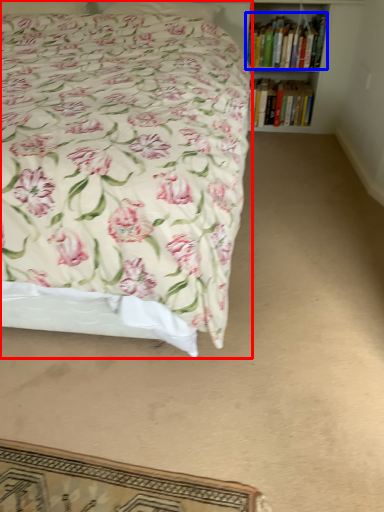
Question: Which of the following is the farthest to the observer, bed (highlighted by a red box) or book (highlighted by a blue box)?

Choices:
 (A) bed
 (B) book

Answer: (B)